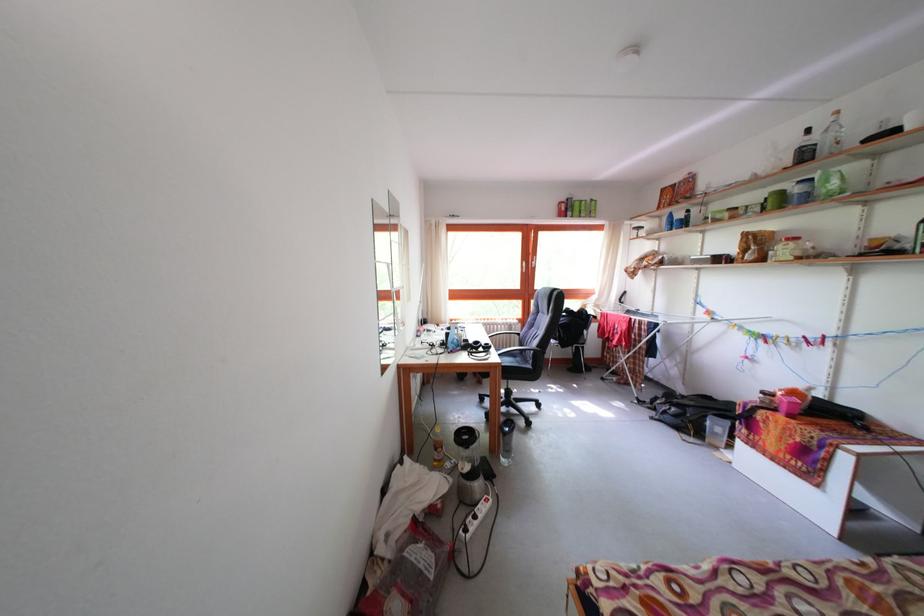
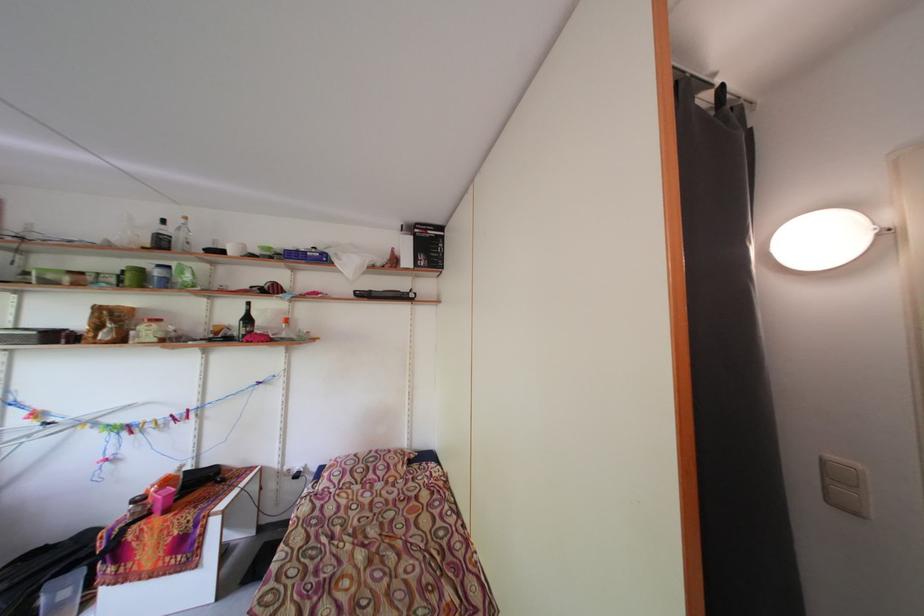
Find the pixel in the second image that matches point (823, 144) in the first image.

(176, 236)